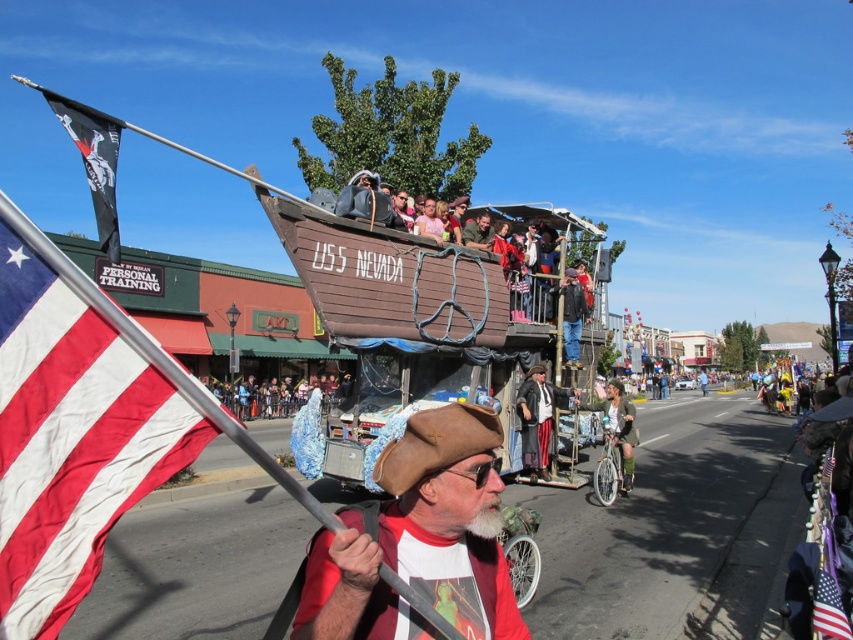
Identify the location of blue fabric at center. The image size is (853, 640). (270, 397).

Where is `blue fabric at center`? This screenshot has height=640, width=853. blue fabric at center is located at coordinates (270, 397).

Describe the element at coordinates (94, 161) in the screenshot. I see `black fabric pirate flag at upper left` at that location.

Does point (109, 145) come behind point (541, 397)?

No.

Identify the location of black fabric pirate flag at upper left. This screenshot has height=640, width=853. (94, 161).

Does american flag at left have a greater width compared to shiny black pirate costume at center?

No, american flag at left is not wider than shiny black pirate costume at center.

Locate an element on the screen. american flag at left is located at coordinates (71, 436).